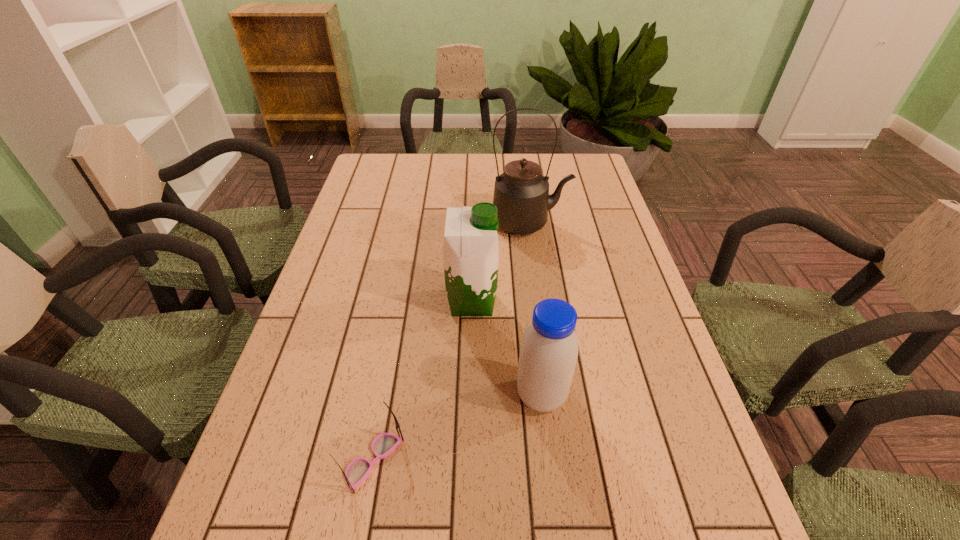
At what (x,y) coordinates should I click in order to perform the action: click on vacant area located on the left of the second nearest object. Please return your answer as a coordinate pair (x, y). Looking at the image, I should click on (356, 396).

You are a GUI agent. You are given a task and a screenshot of the screen. Output one action in this format:
    pyautogui.click(x=<x>, y=<y>)
    Task: Click on the vacant space located 0.110m on the left of the spectacles
    This screenshot has width=960, height=540.
    Given the screenshot: What is the action you would take?
    pyautogui.click(x=286, y=460)

Identify the location of object situated at the right edge. This screenshot has height=540, width=960. (521, 194).

The height and width of the screenshot is (540, 960). Find the location of `free region at the far edge of the desktop`. free region at the far edge of the desktop is located at coordinates (424, 155).

The width and height of the screenshot is (960, 540). In the image, there is a desktop. Identify the location of vacant space at the left edge. (349, 212).

The height and width of the screenshot is (540, 960). In order to click on vacant space at the right edge in this screenshot , I will do `click(616, 349)`.

The height and width of the screenshot is (540, 960). Identify the location of free space between the second farthest object and the third farthest object. tap(507, 349).

The height and width of the screenshot is (540, 960). Find the location of `unoccupied position between the farthest object and the spectacles`. unoccupied position between the farthest object and the spectacles is located at coordinates (452, 341).

Locate an element on the screen. empty space between the farther soya milk and the shortest object is located at coordinates (422, 381).

At what (x,y) coordinates should I click in order to perform the action: click on vacant area between the spectacles and the kettle. Please return your answer as a coordinate pair (x, y). Looking at the image, I should click on (452, 341).